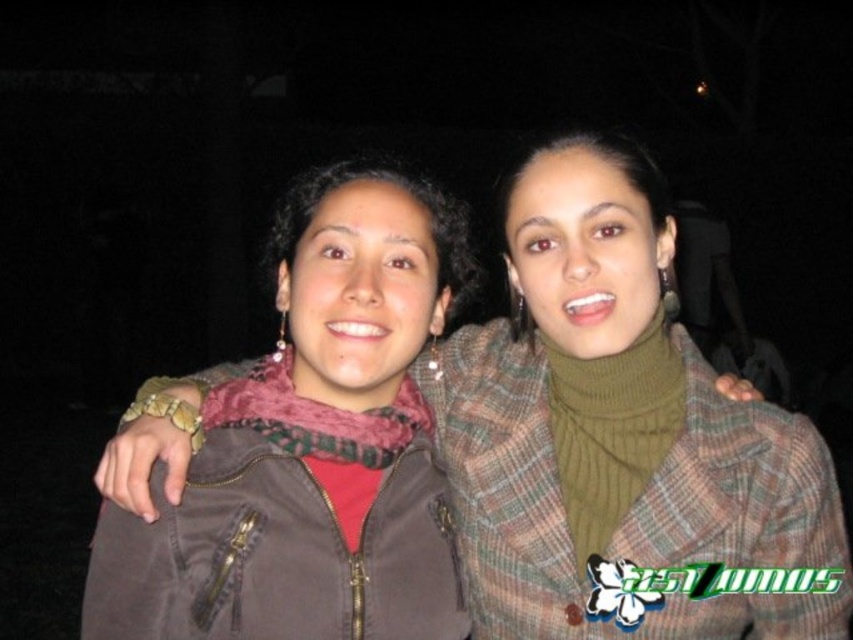
Between matte brown jacket at center and brown matte jacket at center, which one appears on the left side from the viewer's perspective?

Positioned to the left is brown matte jacket at center.

Between matte brown jacket at center and brown matte jacket at center, which one appears on the right side from the viewer's perspective?

Positioned to the right is matte brown jacket at center.

Is point (657, 472) closer to camera compared to point (390, 400)?

Yes, it is.

Find the location of a particular element. The height and width of the screenshot is (640, 853). matte brown jacket at center is located at coordinates pyautogui.click(x=621, y=436).